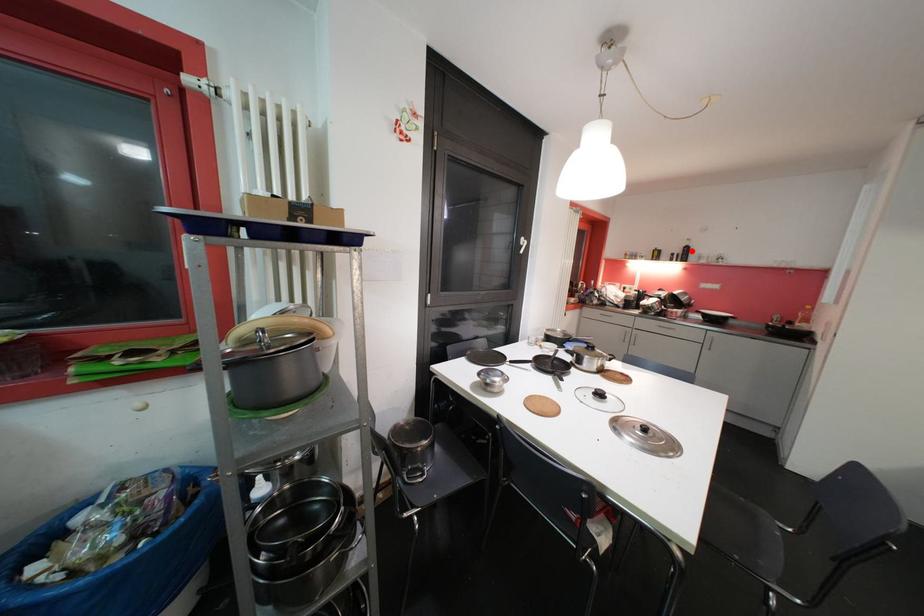
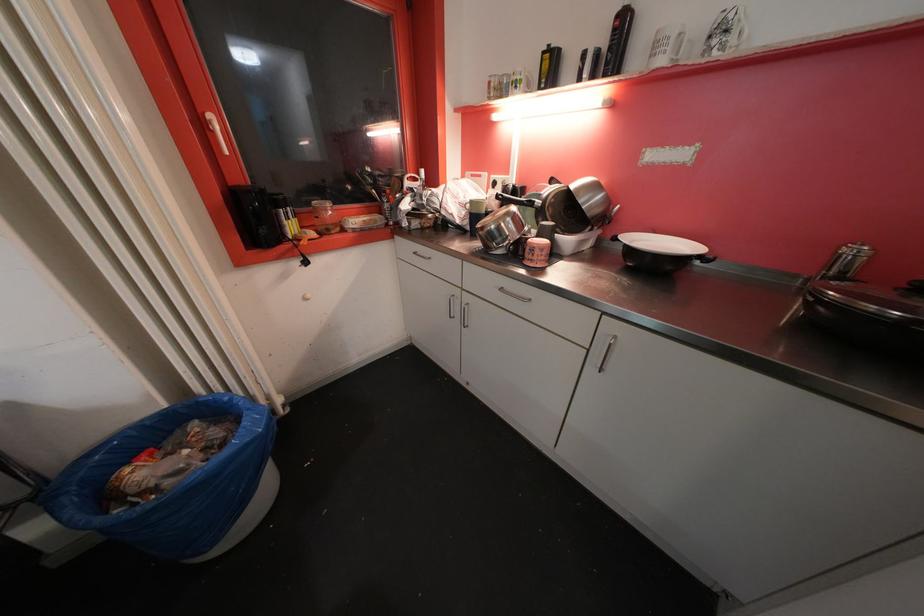
Find the pixel in the second image that matches the highlighted location in the first image.

(628, 25)